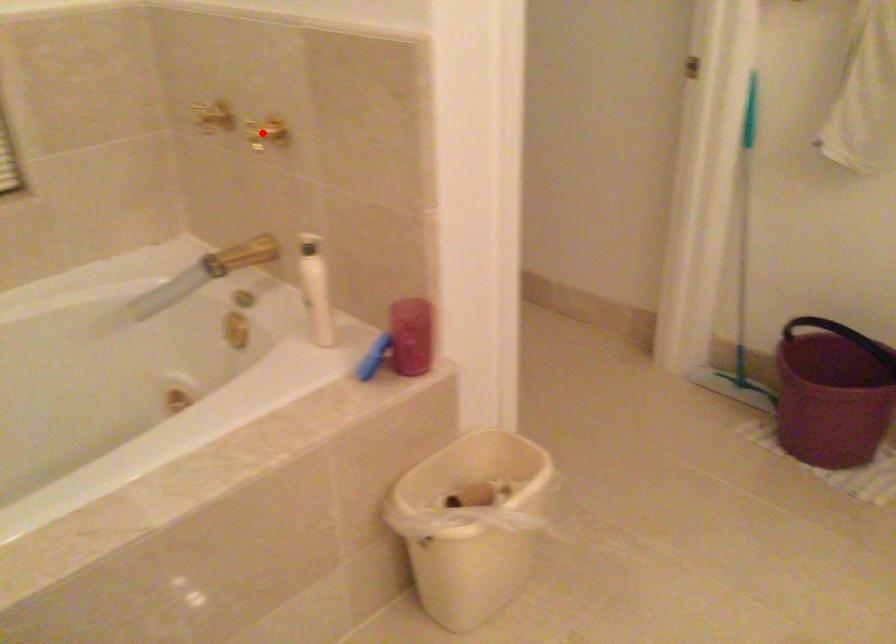
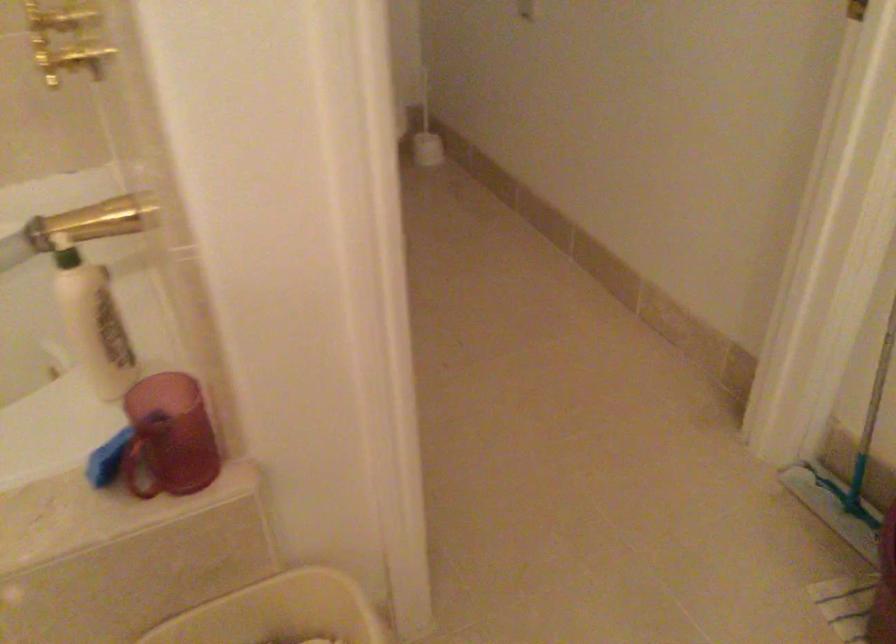
The point at the highlighted location is marked in the first image. Where is the corresponding point in the second image?

(69, 61)